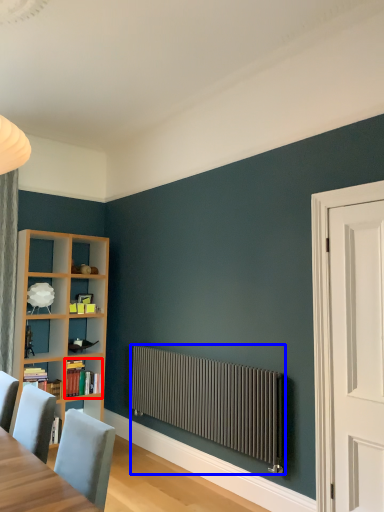
Question: Which object is closer to the camera taking this photo, book (highlighted by a red box) or radiator (highlighted by a blue box)?

Choices:
 (A) book
 (B) radiator

Answer: (B)